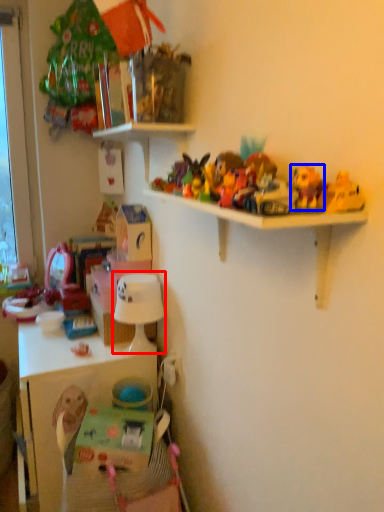
Question: Which object is further to the camera taking this photo, lamp (highlighted by a red box) or toy (highlighted by a blue box)?

Choices:
 (A) lamp
 (B) toy

Answer: (A)